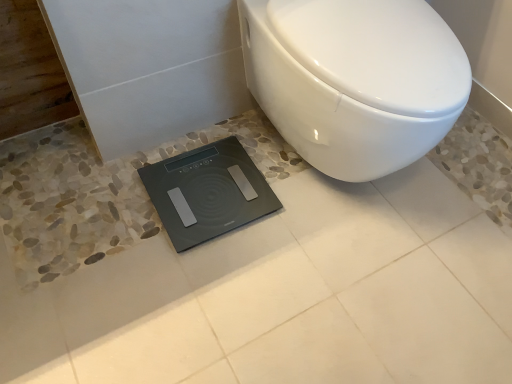
You are a GUI agent. You are given a task and a screenshot of the screen. Output one action in this format:
    pyautogui.click(x=<x>, y=<y>)
    Task: Click on the white glossy toilet at center
    This screenshot has width=512, height=384.
    Given the screenshot: What is the action you would take?
    pyautogui.click(x=355, y=80)

Consider the image. Measure the distance between white glossy toilet at center and camera.

A distance of 81.41 centimeters exists between white glossy toilet at center and camera.

The height and width of the screenshot is (384, 512). What do you see at coordinates (355, 80) in the screenshot?
I see `white glossy toilet at center` at bounding box center [355, 80].

You are a GUI agent. You are given a task and a screenshot of the screen. Output one action in this format:
    pyautogui.click(x=<x>, y=<y>)
    Task: Click on the black glass scale at lower center
    This screenshot has height=384, width=512.
    Given the screenshot: What is the action you would take?
    208,192

This screenshot has width=512, height=384. What do you see at coordinates (208, 192) in the screenshot?
I see `black glass scale at lower center` at bounding box center [208, 192].

This screenshot has height=384, width=512. I want to click on white glossy toilet at center, so click(355, 80).

Considering the positions of objects black glass scale at lower center and white glossy toilet at center in the image provided, who is more to the left, black glass scale at lower center or white glossy toilet at center?

black glass scale at lower center is more to the left.

Consider the image. Is black glass scale at lower center in front of white glossy toilet at center?

No, it is not.

Between point (160, 163) and point (442, 24), which one is positioned behind?

Point (160, 163)

From the image's perspective, is black glass scale at lower center located beneath white glossy toilet at center?

Correct, black glass scale at lower center appears lower than white glossy toilet at center in the image.

From a real-world perspective, which is physically below, black glass scale at lower center or white glossy toilet at center?

In real-world perspective, black glass scale at lower center is lower.

Looking at their sizes, would you say black glass scale at lower center is wider or thinner than white glossy toilet at center?

Considering their sizes, black glass scale at lower center looks slimmer than white glossy toilet at center.

Which of these two, black glass scale at lower center or white glossy toilet at center, stands taller?

With more height is white glossy toilet at center.

Which of these two, black glass scale at lower center or white glossy toilet at center, is smaller?

With smaller size is black glass scale at lower center.

Does black glass scale at lower center contain white glossy toilet at center?

No, black glass scale at lower center does not contain white glossy toilet at center.

Is black glass scale at lower center not close to white glossy toilet at center?

That's not correct — black glass scale at lower center is a little close to white glossy toilet at center.

Is black glass scale at lower center facing towards white glossy toilet at center?

No, black glass scale at lower center is not facing towards white glossy toilet at center.

Based on the photo, what's the angular difference between black glass scale at lower center and white glossy toilet at center's facing directions?

The angle between the facing direction of black glass scale at lower center and the facing direction of white glossy toilet at center is 90.5 degrees.

Find the location of a particular element. The image size is (512, 384). toilet that is on the right side of black glass scale at lower center is located at coordinates (355, 80).

Considering the relative positions of white glossy toilet at center and black glass scale at lower center in the image provided, is white glossy toilet at center to the left of black glass scale at lower center from the viewer's perspective?

In fact, white glossy toilet at center is to the right of black glass scale at lower center.

Which is in front, white glossy toilet at center or black glass scale at lower center?

Positioned in front is white glossy toilet at center.

Between point (278, 27) and point (209, 165), which one is positioned behind?

The point (209, 165) is more distant.

From the image's perspective, which one is positioned higher, white glossy toilet at center or black glass scale at lower center?

white glossy toilet at center.

In the scene shown: From a real-world perspective, between white glossy toilet at center and black glass scale at lower center, who is vertically higher?

white glossy toilet at center is physically above.

Does white glossy toilet at center have a lesser width compared to black glass scale at lower center?

Incorrect, the width of white glossy toilet at center is not less than that of black glass scale at lower center.

In the scene shown: Which of these two, white glossy toilet at center or black glass scale at lower center, stands shorter?

With less height is black glass scale at lower center.

From the picture: Which of these two, white glossy toilet at center or black glass scale at lower center, is smaller?

black glass scale at lower center.

Is white glossy toilet at center not inside black glass scale at lower center?

white glossy toilet at center lies outside black glass scale at lower center's area.

Is there a large distance between white glossy toilet at center and black glass scale at lower center?

No, there isn't a large distance between white glossy toilet at center and black glass scale at lower center.

Is white glossy toilet at center oriented away from black glass scale at lower center?

white glossy toilet at center does not have its back to black glass scale at lower center.

You are a GUI agent. You are given a task and a screenshot of the screen. Output one action in this format:
    pyautogui.click(x=<x>, y=<y>)
    Task: Click on the toilet located on the right of black glass scale at lower center
    Image resolution: width=512 pixels, height=384 pixels.
    Given the screenshot: What is the action you would take?
    pyautogui.click(x=355, y=80)

Image resolution: width=512 pixels, height=384 pixels. Find the location of `scale that is on the left side of white glossy toilet at center`. scale that is on the left side of white glossy toilet at center is located at coordinates (208, 192).

The image size is (512, 384). I want to click on toilet located above the black glass scale at lower center (from the image's perspective), so click(355, 80).